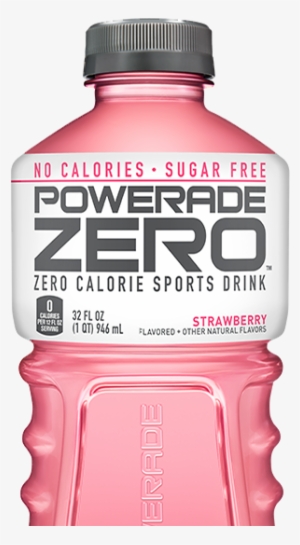
This screenshot has width=300, height=545. I want to click on bottle, so click(178, 171).